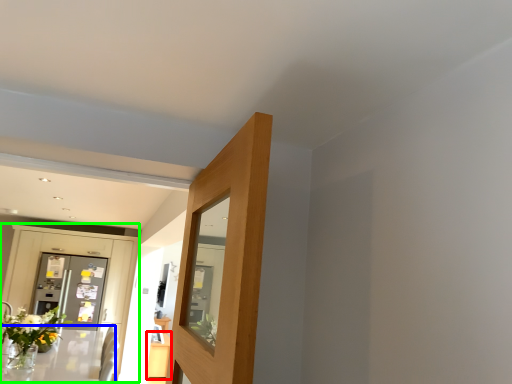
Question: Which object is positioned farthest from table (highlighted by a red box)? Select from table (highlighted by a blue box) and dresser (highlighted by a green box).

Choices:
 (A) table
 (B) dresser

Answer: (B)